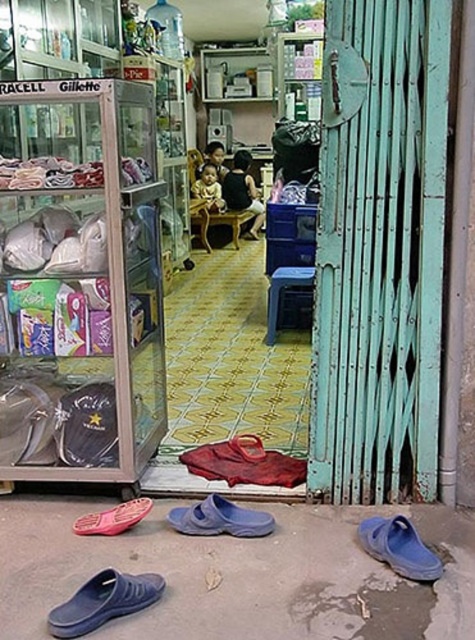
You are a delivery person who needs to place a large box in the shop. The box requires a clear space of at least 1 meter in width. Based on the scene, is there enough space near the transparent plastic display case at left to accommodate the box?

The transparent plastic display case at left is located at point (79, 282). Since the exact dimensions of the space around it aren

You are a delivery person trying to enter the shop through the teal painted metal gate at right. You notice a blue rubber clog at lower right blocking your path. Can you step over it without moving the clog?

The distance between the teal painted metal gate at right and the blue rubber clog at lower right is 25.19 inches. Since the blue rubber clog is only an obstacle at the lower right, stepping over it would be possible as the distance allows enough space to maneuver around it while approaching the gate.